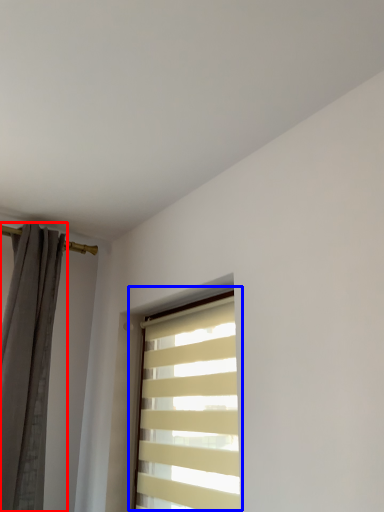
Question: Among these objects, which one is farthest to the camera, curtain (highlighted by a red box) or window (highlighted by a blue box)?

Choices:
 (A) curtain
 (B) window

Answer: (A)